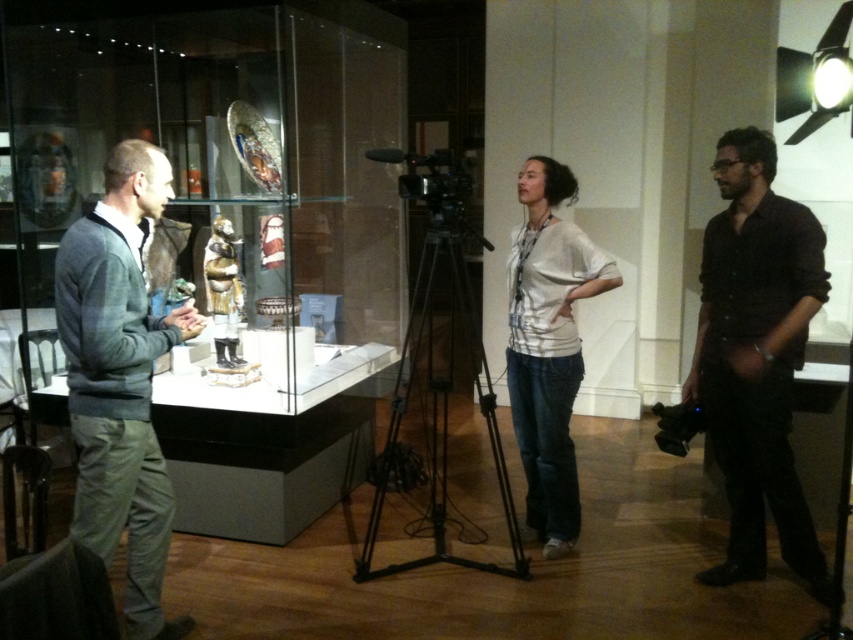
Who is higher up, transparent glass box at center or black metal tripod at center?

transparent glass box at center is above.

Between point (119, 134) and point (473, 332), which one is positioned in front?

Point (119, 134)

The height and width of the screenshot is (640, 853). In order to click on transparent glass box at center in this screenshot , I will do `click(229, 230)`.

Is transparent glass box at center smaller than gray sweater at left?

No, transparent glass box at center is not smaller than gray sweater at left.

Who is higher up, transparent glass box at center or gray sweater at left?

transparent glass box at center is above.

At what (x,y) coordinates should I click in order to perform the action: click on transparent glass box at center. Please return your answer as a coordinate pair (x, y). The image size is (853, 640). Looking at the image, I should click on (229, 230).

The height and width of the screenshot is (640, 853). What do you see at coordinates (756, 356) in the screenshot?
I see `black matte shirt at right` at bounding box center [756, 356].

Who is more distant from viewer, (750, 186) or (444, 394)?

The point (444, 394) is more distant.

The image size is (853, 640). I want to click on black matte shirt at right, so click(756, 356).